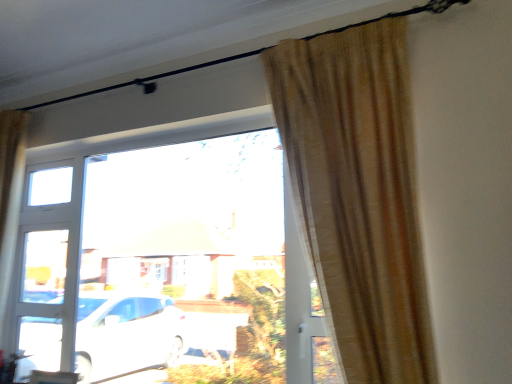
Question: Visually, is transparent glass window at center positioned to the left or to the right of beige textured curtain at right?

Choices:
 (A) right
 (B) left

Answer: (B)

Question: In terms of height, does transparent glass window at center look taller or shorter compared to beige textured curtain at right?

Choices:
 (A) short
 (B) tall

Answer: (B)

Question: From the image's perspective, is transparent glass window at center positioned above or below beige textured curtain at right?

Choices:
 (A) below
 (B) above

Answer: (A)

Question: From a real-world perspective, is beige textured curtain at right physically located above or below transparent glass window at center?

Choices:
 (A) below
 (B) above

Answer: (B)

Question: Is beige textured curtain at right wider or thinner than transparent glass window at center?

Choices:
 (A) thin
 (B) wide

Answer: (B)

Question: From the image's perspective, is beige textured curtain at right positioned above or below transparent glass window at center?

Choices:
 (A) below
 (B) above

Answer: (B)

Question: Considering the relative positions of beige textured curtain at right and transparent glass window at center in the image provided, is beige textured curtain at right to the left or to the right of transparent glass window at center?

Choices:
 (A) left
 (B) right

Answer: (B)